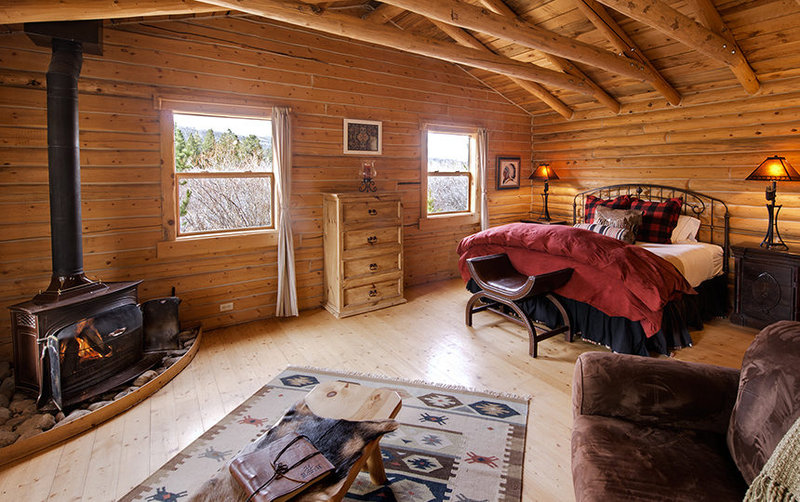
In order to click on chimney in this screenshot , I will do `click(61, 175)`.